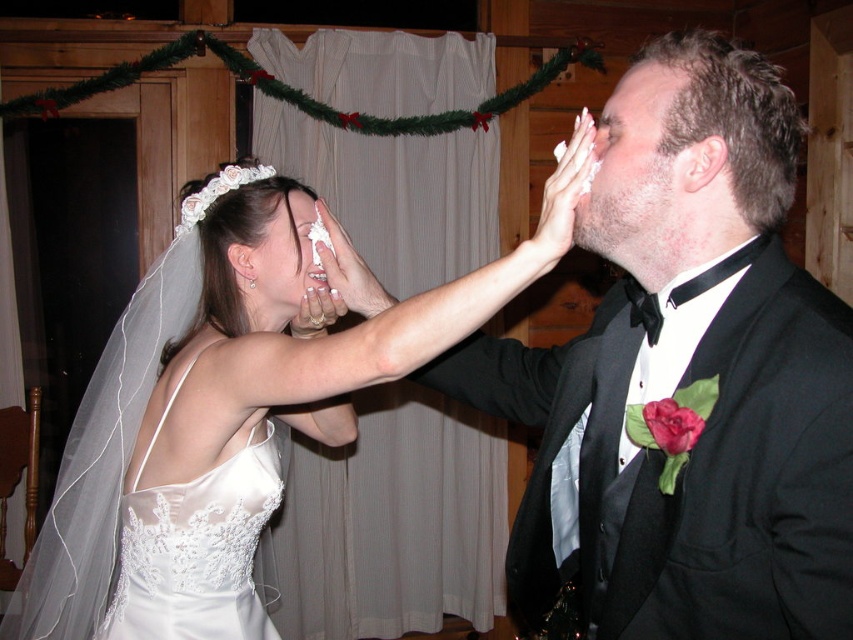
Which is below, matte white cake at upper center or matte black forehead at upper right?

Positioned lower is matte white cake at upper center.

Between matte white cake at upper center and matte black forehead at upper right, which one has less height?

matte black forehead at upper right is shorter.

Where is `matte white cake at upper center`? The image size is (853, 640). matte white cake at upper center is located at coordinates (286, 260).

Is point (227, 260) behind point (271, 243)?

That is True.

At what (x,y) coordinates should I click in order to perform the action: click on white satin dress at center. Please return your answer as a coordinate pair (x, y). Looking at the image, I should click on (225, 419).

Can you confirm if white satin dress at center is positioned to the right of matte black forehead at upper right?

Incorrect, white satin dress at center is not on the right side of matte black forehead at upper right.

I want to click on white satin dress at center, so click(x=225, y=419).

Which is in front, point (163, 364) or point (666, 81)?

Point (666, 81) is more forward.

The image size is (853, 640). Find the location of `white satin dress at center`. white satin dress at center is located at coordinates (225, 419).